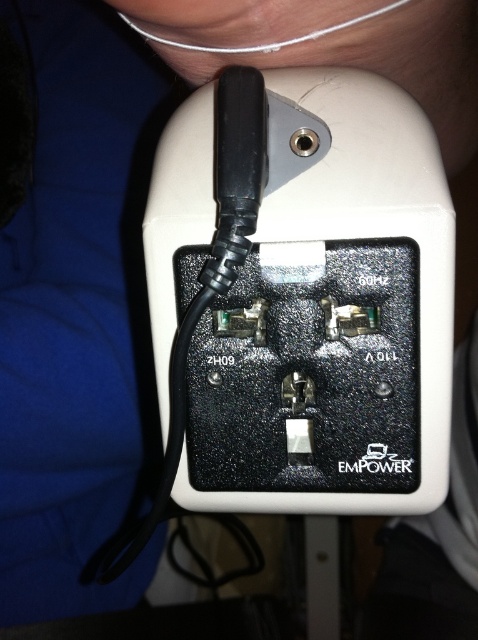
Does black textured power outlet at center appear under white wire at upper center?

Indeed, black textured power outlet at center is positioned under white wire at upper center.

Is black textured power outlet at center positioned before white wire at upper center?

Yes, it is in front of white wire at upper center.

Does point (391, 216) come farther from viewer compared to point (364, 17)?

Yes.

Locate an element on the screen. Image resolution: width=478 pixels, height=640 pixels. black textured power outlet at center is located at coordinates (307, 298).